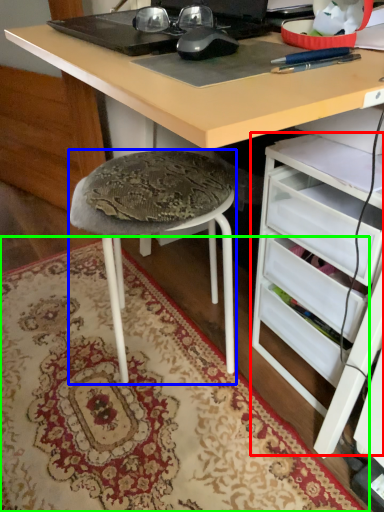
Question: Considering the real-world distances, which object is closest to file cabinet (highlighted by a red box)? stool (highlighted by a blue box) or mat (highlighted by a green box).

Choices:
 (A) stool
 (B) mat

Answer: (A)